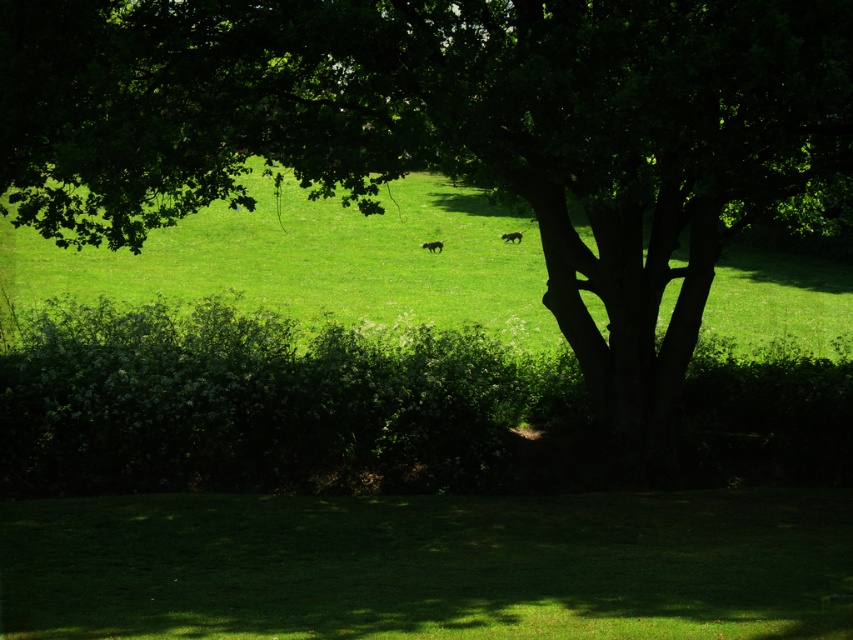
You are standing at point (x=451, y=132) in this outdoor scene. What object is located exactly at your current position?

The green leafy tree at center is located exactly at point (x=451, y=132).

You are standing at the edge of the green grassy field at center and want to walk towards the green leafy hedge at lower center. Which direction should you head?

The green leafy hedge at lower center is to the left of the green grassy field at center, so you should head left to reach it.

You are a photographer trying to capture both the black fur dog at center and the brown fur dog at center in a single shot. Given that your camera has a maximum focus range of 2 meters, can you confirm if both dogs are within the focus range?

The black fur dog at center is larger in size than brown fur dog at center, but since both are at the same center position, they are within the 2 meters focus range.